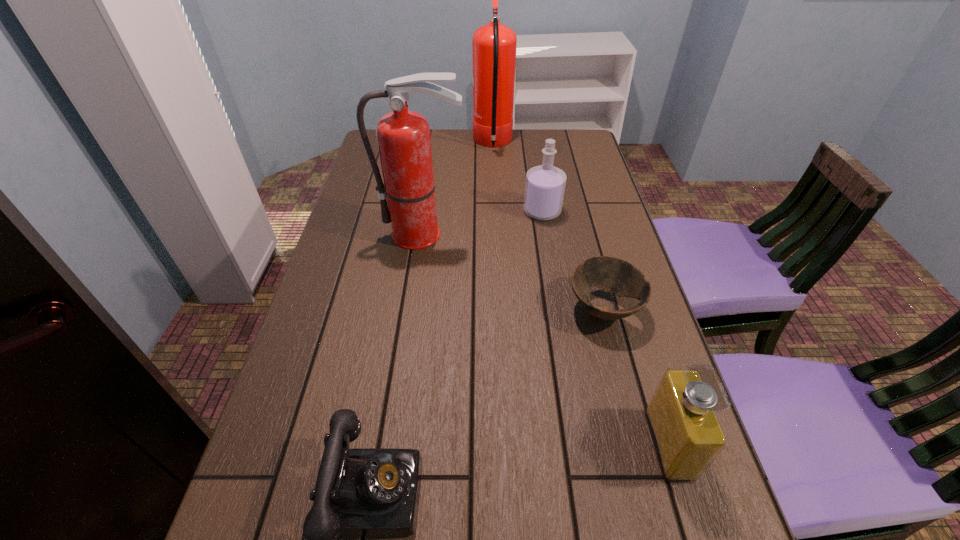
This screenshot has width=960, height=540. I want to click on free location at the left edge of the desktop, so click(326, 268).

Locate an element on the screen. Image resolution: width=960 pixels, height=540 pixels. empty space that is in between the shortest object and the left perfume is located at coordinates (573, 260).

Where is `vacant area between the nearer perfume and the nearer fire extinguisher`? The width and height of the screenshot is (960, 540). vacant area between the nearer perfume and the nearer fire extinguisher is located at coordinates (546, 339).

The height and width of the screenshot is (540, 960). Find the location of `empty location between the nearer perfume and the third nearest object`. empty location between the nearer perfume and the third nearest object is located at coordinates (636, 376).

I want to click on free space between the nearer perfume and the left fire extinguisher, so click(546, 339).

Locate an element on the screen. Image resolution: width=960 pixels, height=540 pixels. unoccupied area between the farther perfume and the right perfume is located at coordinates (x=606, y=328).

Where is `vacant area between the nearer perfume and the left fire extinguisher`? The height and width of the screenshot is (540, 960). vacant area between the nearer perfume and the left fire extinguisher is located at coordinates (546, 339).

Locate which object ranks second in proximity to the right fire extinguisher. Please provide its 2D coordinates. Your answer should be formatted as a tuple, i.e. [(x, y)], where the tuple contains the x and y coordinates of a point satisfying the conditions above.

[(403, 137)]

Identify which object is the fifth nearest to the third object from left to right. Please provide its 2D coordinates. Your answer should be formatted as a tuple, i.e. [(x, y)], where the tuple contains the x and y coordinates of a point satisfying the conditions above.

[(363, 491)]

Where is `vacant region that satisfies the following two spatial constraints: 1. on the front side of the farther perfume; 2. on the left side of the bowl`? The width and height of the screenshot is (960, 540). vacant region that satisfies the following two spatial constraints: 1. on the front side of the farther perfume; 2. on the left side of the bowl is located at coordinates (559, 309).